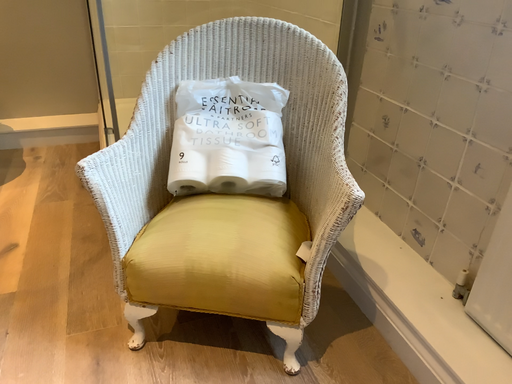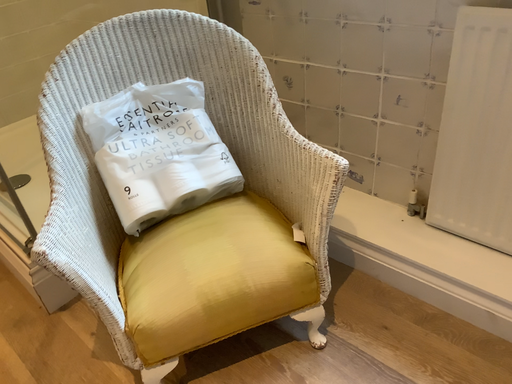
Question: Which way did the camera rotate in the video?

Choices:
 (A) rotated left
 (B) rotated right

Answer: (B)